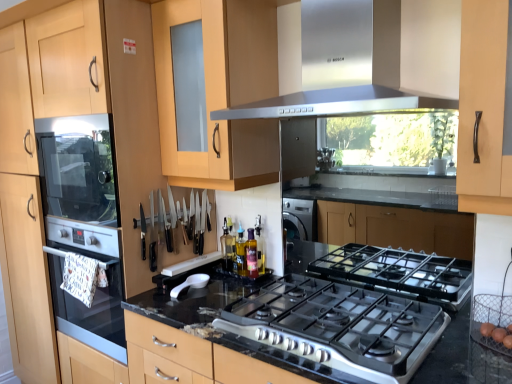
In order to face stainless steel range hood at upper center, should I rotate leftwards or rightwards?

Rotate right and turn 9.503 degrees.

Locate an element on the screen. Image resolution: width=512 pixels, height=384 pixels. stainless steel range hood at upper center is located at coordinates (334, 103).

The image size is (512, 384). What do you see at coordinates (251, 254) in the screenshot?
I see `translucent glass bottle at center, which is the second bottle in back-to-front order` at bounding box center [251, 254].

What do you see at coordinates (186, 220) in the screenshot? I see `black plastic knives at center` at bounding box center [186, 220].

Identify the location of black granite countertop at center. (462, 357).

You are a GUI agent. You are given a task and a screenshot of the screen. Output one action in this format:
    pyautogui.click(x=<x>, y=<y>)
    Task: Click on the white plastic spoon at center
    The height and width of the screenshot is (384, 512).
    Given the screenshot: What is the action you would take?
    pyautogui.click(x=190, y=284)

Where is `translucent glass bottle at center, the first bottle when ordered from left to right`? The height and width of the screenshot is (384, 512). translucent glass bottle at center, the first bottle when ordered from left to right is located at coordinates (227, 247).

Between stainless steel range hood at upper center and black plastic knives at center, which one has larger size?

Bigger between the two is stainless steel range hood at upper center.

Is stainless steel range hood at upper center in contact with black plastic knives at center?

No, stainless steel range hood at upper center is not in contact with black plastic knives at center.

Is black plastic knives at center at the back of stainless steel range hood at upper center?

That's not correct — stainless steel range hood at upper center is not looking away from black plastic knives at center.

From a real-world perspective, is stainless steel range hood at upper center over black plastic knives at center?

Correct, in the physical world, stainless steel range hood at upper center is higher than black plastic knives at center.

From the image's perspective, relative to light wood/texture cabinet at left, is translucent glass bottle at center, placed as the 1th bottle when sorted from right to left, above or below?

translucent glass bottle at center, placed as the 1th bottle when sorted from right to left, is below light wood/texture cabinet at left.

Can light wood/texture cabinet at left be found inside translucent glass bottle at center, placed as the 1th bottle when sorted from right to left?

No, light wood/texture cabinet at left is not inside translucent glass bottle at center, placed as the 1th bottle when sorted from right to left.

Is translucent glass bottle at center, which is the second bottle in back-to-front order, turned away from light wood/texture cabinet at left?

No, translucent glass bottle at center, which is the second bottle in back-to-front order, is not facing away from light wood/texture cabinet at left.

How far apart are light wood/texture cabinet at left and stainless steel range hood at upper center?

light wood/texture cabinet at left is 36.21 inches away from stainless steel range hood at upper center.

Considering the relative sizes of light wood/texture cabinet at left and stainless steel range hood at upper center in the image provided, is light wood/texture cabinet at left shorter than stainless steel range hood at upper center?

In fact, light wood/texture cabinet at left may be taller than stainless steel range hood at upper center.

Considering the points (153, 150) and (447, 100), which point is in front, point (153, 150) or point (447, 100)?

Point (447, 100)

Between light wood/texture cabinet at left and stainless steel range hood at upper center, which one is positioned in front?

stainless steel range hood at upper center is in front.

Is light wood/texture cabinet at left outside of translucent glass bottle at center, placed as the 1th bottle when sorted from right to left?

light wood/texture cabinet at left lies outside translucent glass bottle at center, placed as the 1th bottle when sorted from right to left,'s area.

From a real-world perspective, between light wood/texture cabinet at left and translucent glass bottle at center, which ranks as the second bottle in left-to-right order, who is vertically lower?

translucent glass bottle at center, which ranks as the second bottle in left-to-right order, is physically lower.

Is light wood/texture cabinet at left taller than translucent glass bottle at center, placed as the 1th bottle when sorted from right to left?

Yes, light wood/texture cabinet at left is taller than translucent glass bottle at center, placed as the 1th bottle when sorted from right to left.

Which point is more forward, (498, 377) or (222, 237)?

The point (498, 377) is more forward.

In terms of width, does black granite countertop at center look wider or thinner when compared to translucent glass bottle at center, acting as the second bottle starting from the front?

In the image, black granite countertop at center appears to be wider than translucent glass bottle at center, acting as the second bottle starting from the front.

Is black granite countertop at center facing away from translucent glass bottle at center, acting as the second bottle starting from the front?

black granite countertop at center does not have its back to translucent glass bottle at center, acting as the second bottle starting from the front.

Is black granite countertop at center bigger or smaller than translucent glass bottle at center, marked as the 1th bottle in a back-to-front arrangement?

Clearly, black granite countertop at center is larger in size than translucent glass bottle at center, marked as the 1th bottle in a back-to-front arrangement.

Is stainless steel range hood at upper center at the right side of translucent glass bottle at center, which ranks as the second bottle in left-to-right order?

Yes.

Which is behind, stainless steel range hood at upper center or translucent glass bottle at center, which ranks as the second bottle in left-to-right order?

Positioned behind is translucent glass bottle at center, which ranks as the second bottle in left-to-right order.

Could you tell me if stainless steel range hood at upper center is facing translucent glass bottle at center, which is counted as the first bottle, starting from the front?

No, stainless steel range hood at upper center is not facing towards translucent glass bottle at center, which is counted as the first bottle, starting from the front.

At what (x,y) coordinates should I click in order to perform the action: click on home appliance that appears on the right of translucent glass bottle at center, placed as the 1th bottle when sorted from right to left. Please return your answer as a coordinate pair (x, y). Looking at the image, I should click on (334, 103).

Is white plastic spoon at center next to black plastic knives at center and touching it?

No, white plastic spoon at center is not in contact with black plastic knives at center.

Can you confirm if white plastic spoon at center is smaller than black plastic knives at center?

Yes, white plastic spoon at center is smaller than black plastic knives at center.

Is white plastic spoon at center facing towards black plastic knives at center?

No, white plastic spoon at center is not oriented towards black plastic knives at center.

Image resolution: width=512 pixels, height=384 pixels. I want to click on cutlery lying below the stainless steel range hood at upper center (from the image's perspective), so click(x=186, y=220).

The width and height of the screenshot is (512, 384). Identify the location of cabinetry that appears above the translucent glass bottle at center, which is counted as the first bottle, starting from the front (from the image's perspective). point(71,115).

Looking at the image, which one is located further to white plastic spoon at center, black granite countertop at center or translucent glass bottle at center, marked as the 1th bottle in a back-to-front arrangement?

black granite countertop at center is further to white plastic spoon at center.

Which object lies further to the anchor point stainless steel range hood at upper center, black plastic knives at center or white plastic spoon at center?

white plastic spoon at center is positioned further to the anchor stainless steel range hood at upper center.

When comparing their distances from black granite countertop at center, does black stainless steel gas stove at center or light wood/texture cabinet at left seem further?

light wood/texture cabinet at left is further to black granite countertop at center.

When comparing their distances from black plastic knives at center, does white plastic spoon at center or translucent glass bottle at center, acting as the second bottle starting from the front, seem further?

white plastic spoon at center is further to black plastic knives at center.

Estimate the real-world distances between objects in this image. Which object is closer to black granite countertop at center, black stainless steel gas stove at center or black plastic knives at center?

black stainless steel gas stove at center lies closer to black granite countertop at center than the other object.

Considering their positions, is black stainless steel gas stove at center positioned further to stainless steel range hood at upper center than black plastic knives at center?

Among the two, black stainless steel gas stove at center is located further to stainless steel range hood at upper center.

Based on their spatial positions, is black plastic knives at center or black stainless steel gas stove at center further from translucent glass bottle at center, the first bottle when ordered from left to right?

black stainless steel gas stove at center is further to translucent glass bottle at center, the first bottle when ordered from left to right.

When comparing their distances from black granite countertop at center, does stainless steel range hood at upper center or black plastic knives at center seem closer?

black plastic knives at center lies closer to black granite countertop at center than the other object.

You are a GUI agent. You are given a task and a screenshot of the screen. Output one action in this format:
    pyautogui.click(x=<x>, y=<y>)
    Task: Click on the cutlery between stainless steel range hood at upper center and black stainless steel gas stove at center in the vertical direction
    
    Given the screenshot: What is the action you would take?
    pyautogui.click(x=186, y=220)

Identify the location of cutlery located between black stainless steel gas stove at center and translucent glass bottle at center, which is the second bottle in back-to-front order, in the depth direction. (186, 220).

The height and width of the screenshot is (384, 512). Identify the location of cutlery between light wood/texture cabinet at left and black stainless steel gas stove at center from left to right. (186, 220).

Where is `gas stove positioned between black granite countertop at center and black plastic knives at center from near to far`? The height and width of the screenshot is (384, 512). gas stove positioned between black granite countertop at center and black plastic knives at center from near to far is located at coordinates (339, 326).